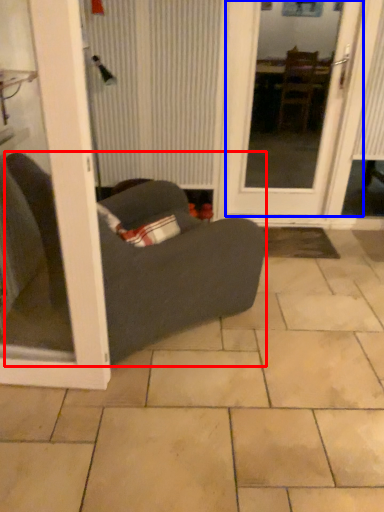
Question: Which of the following is the farthest to the observer, studio couch (highlighted by a red box) or door (highlighted by a blue box)?

Choices:
 (A) studio couch
 (B) door

Answer: (B)